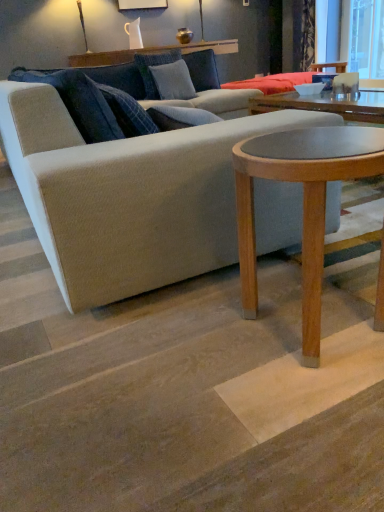
Question: Is beige fabric couch at center in contact with textured gray pillow at center, acting as the 1th pillow starting from the front?

Choices:
 (A) yes
 (B) no

Answer: (B)

Question: Considering the relative sizes of beige fabric couch at center and textured gray pillow at center, acting as the 1th pillow starting from the front, in the image provided, is beige fabric couch at center thinner than textured gray pillow at center, acting as the 1th pillow starting from the front,?

Choices:
 (A) no
 (B) yes

Answer: (A)

Question: From a real-world perspective, is beige fabric couch at center physically below textured gray pillow at center, acting as the 1th pillow starting from the front?

Choices:
 (A) no
 (B) yes

Answer: (B)

Question: Considering the relative sizes of beige fabric couch at center and textured gray pillow at center, which is counted as the second pillow, starting from the back, in the image provided, is beige fabric couch at center smaller than textured gray pillow at center, which is counted as the second pillow, starting from the back,?

Choices:
 (A) no
 (B) yes

Answer: (A)

Question: Can you confirm if beige fabric couch at center is bigger than textured gray pillow at center, which is counted as the second pillow, starting from the back?

Choices:
 (A) no
 (B) yes

Answer: (B)

Question: Are beige fabric couch at center and textured gray pillow at center, acting as the 1th pillow starting from the front, far apart?

Choices:
 (A) yes
 (B) no

Answer: (A)

Question: Is beige fabric couch at center positioned behind transparent glass window screen at upper right?

Choices:
 (A) yes
 (B) no

Answer: (B)

Question: Is beige fabric couch at center located outside transparent glass window screen at upper right?

Choices:
 (A) yes
 (B) no

Answer: (A)

Question: Does beige fabric couch at center turn towards transparent glass window screen at upper right?

Choices:
 (A) no
 (B) yes

Answer: (B)

Question: Is beige fabric couch at center thinner than transparent glass window screen at upper right?

Choices:
 (A) no
 (B) yes

Answer: (A)

Question: Is beige fabric couch at center smaller than transparent glass window screen at upper right?

Choices:
 (A) no
 (B) yes

Answer: (A)

Question: Considering the relative sizes of beige fabric couch at center and transparent glass window screen at upper right in the image provided, is beige fabric couch at center wider than transparent glass window screen at upper right?

Choices:
 (A) yes
 (B) no

Answer: (A)

Question: From the image's perspective, would you say textured blue pillow at upper center, arranged as the 1th pillow when viewed from the back, is positioned over velvet dark blue curtain at upper right?

Choices:
 (A) yes
 (B) no

Answer: (B)